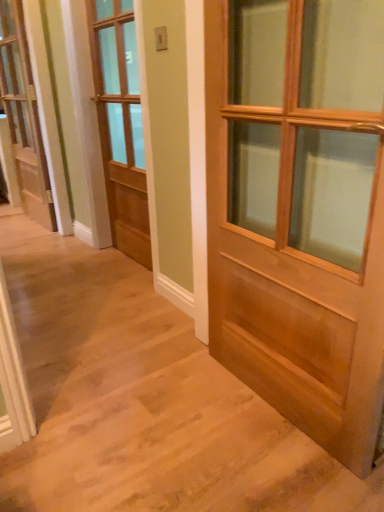
Question: In which direction should I rotate to look at light brown wooden door at center, placed as the first door when sorted from front to back?

Choices:
 (A) left
 (B) right

Answer: (B)

Question: Considering the relative sizes of light brown wood door at center, acting as the 2th door starting from the back, and white painted wood door at left, placed as the third door when sorted from front to back, in the image provided, is light brown wood door at center, acting as the 2th door starting from the back, taller than white painted wood door at left, placed as the third door when sorted from front to back,?

Choices:
 (A) no
 (B) yes

Answer: (A)

Question: Does light brown wood door at center, the 2th door positioned from the front, come in front of white painted wood door at left, placed as the third door when sorted from front to back?

Choices:
 (A) yes
 (B) no

Answer: (A)

Question: Is light brown wood door at center, the 2th door positioned from the front, thinner than white painted wood door at left, placed as the third door when sorted from front to back?

Choices:
 (A) yes
 (B) no

Answer: (B)

Question: Does light brown wood door at center, the 2th door positioned from the front, have a smaller size compared to white painted wood door at left, marked as the 1th door in a back-to-front arrangement?

Choices:
 (A) yes
 (B) no

Answer: (B)

Question: Considering the relative positions of light brown wood door at center, the 2th door from the left, and white painted wood door at left, positioned as the 3th door in right-to-left order, in the image provided, is light brown wood door at center, the 2th door from the left, to the right of white painted wood door at left, positioned as the 3th door in right-to-left order, from the viewer's perspective?

Choices:
 (A) no
 (B) yes

Answer: (B)

Question: Can you confirm if light brown wood door at center, the 2th door positioned from the front, is wider than white painted wood door at left, marked as the 1th door in a back-to-front arrangement?

Choices:
 (A) yes
 (B) no

Answer: (A)

Question: Does light brown wooden door at center, placed as the first door when sorted from front to back, contain light brown wood door at center, acting as the 2th door starting from the right?

Choices:
 (A) yes
 (B) no

Answer: (B)

Question: Considering the relative sizes of light brown wooden door at center, the 1th door in the right-to-left sequence, and light brown wood door at center, acting as the 2th door starting from the back, in the image provided, is light brown wooden door at center, the 1th door in the right-to-left sequence, thinner than light brown wood door at center, acting as the 2th door starting from the back,?

Choices:
 (A) no
 (B) yes

Answer: (A)

Question: From the image's perspective, would you say light brown wooden door at center, the 1th door in the right-to-left sequence, is positioned over light brown wood door at center, the 2th door from the left?

Choices:
 (A) yes
 (B) no

Answer: (B)

Question: Is light brown wooden door at center, placed as the first door when sorted from front to back, aimed at light brown wood door at center, the 2th door positioned from the front?

Choices:
 (A) yes
 (B) no

Answer: (B)

Question: Considering the relative sizes of light brown wooden door at center, placed as the first door when sorted from front to back, and light brown wood door at center, acting as the 2th door starting from the back, in the image provided, is light brown wooden door at center, placed as the first door when sorted from front to back, smaller than light brown wood door at center, acting as the 2th door starting from the back,?

Choices:
 (A) yes
 (B) no

Answer: (B)

Question: From a real-world perspective, is light brown wooden door at center, marked as the third door in a back-to-front arrangement, physically below light brown wood door at center, the 2th door from the left?

Choices:
 (A) no
 (B) yes

Answer: (B)

Question: Can you confirm if white painted wood door at left, placed as the third door when sorted from front to back, is positioned to the left of light brown wooden door at center, the 1th door in the right-to-left sequence?

Choices:
 (A) yes
 (B) no

Answer: (A)